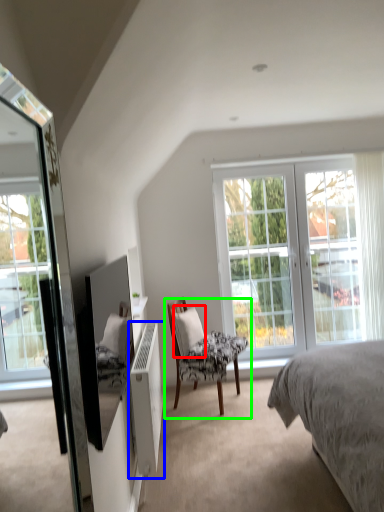
Question: Considering the real-world distances, which object is farthest from pillow (highlighted by a red box)? radiator (highlighted by a blue box) or chair (highlighted by a green box)?

Choices:
 (A) radiator
 (B) chair

Answer: (A)